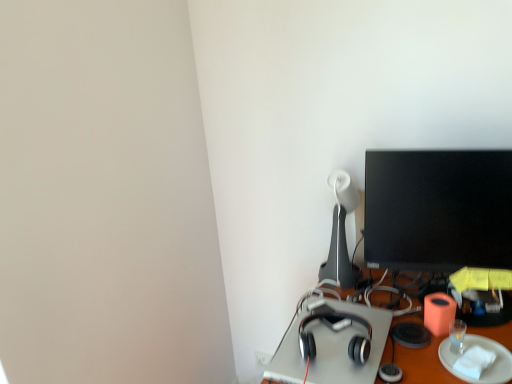
Find the location of a particular element. The image size is (512, 384). free space behind satin silver headphones at center-right is located at coordinates (333, 305).